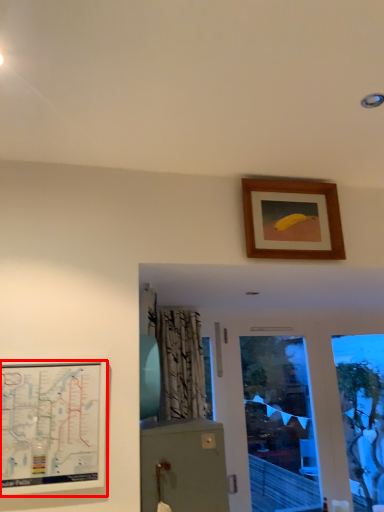
Question: In this image, where is picture frame (annotated by the red box) located relative to picture frame?

Choices:
 (A) left
 (B) right

Answer: (A)